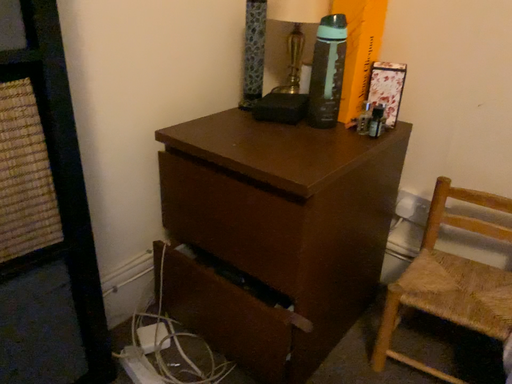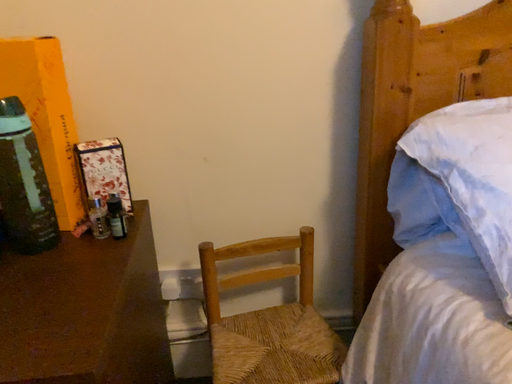
Question: Which way did the camera rotate in the video?

Choices:
 (A) rotated downward
 (B) rotated upward

Answer: (B)